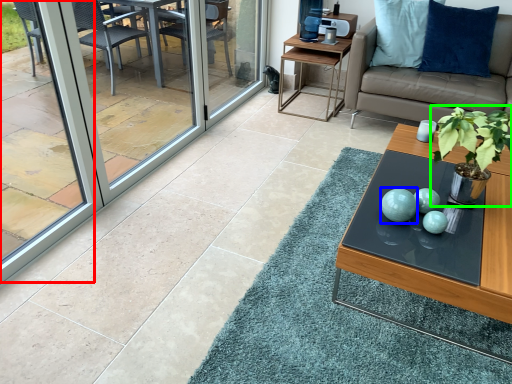
Question: Which object is the farthest from window screen (highlighted by a red box)? Choose among these: turquoise (highlighted by a blue box) or houseplant (highlighted by a green box).

Choices:
 (A) turquoise
 (B) houseplant

Answer: (B)